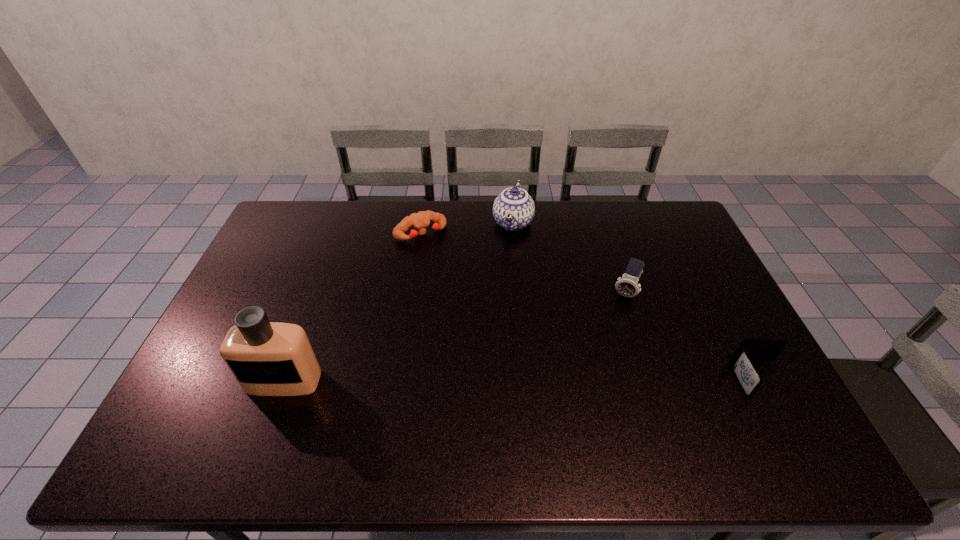
Find the location of `wallet that is at the near edge`. wallet that is at the near edge is located at coordinates (749, 350).

Where is `object that is at the left edge`? Image resolution: width=960 pixels, height=540 pixels. object that is at the left edge is located at coordinates (x=267, y=358).

Identify the location of object situated at the right edge. [x=749, y=350].

Locate an element on the screen. Image resolution: width=960 pixels, height=540 pixels. object that is at the near left corner is located at coordinates (267, 358).

Identify the location of object that is at the near right corner. The width and height of the screenshot is (960, 540). (749, 350).

This screenshot has height=540, width=960. I want to click on free space at the far edge of the desktop, so [538, 230].

You are a GUI agent. You are given a task and a screenshot of the screen. Output one action in this format:
    pyautogui.click(x=<x>, y=<y>)
    Task: Click on the free space at the left edge of the desktop
    
    Given the screenshot: What is the action you would take?
    pyautogui.click(x=306, y=243)

Find the location of a particular element. This screenshot has width=960, height=540. vacant space at the near left corner of the desktop is located at coordinates (209, 388).

The height and width of the screenshot is (540, 960). What are the coordinates of `free space at the near right corner of the desktop` in the screenshot? It's located at (756, 416).

Locate an element on the screen. Image resolution: width=960 pixels, height=540 pixels. free spot between the leftmost object and the second object from right to left is located at coordinates (455, 337).